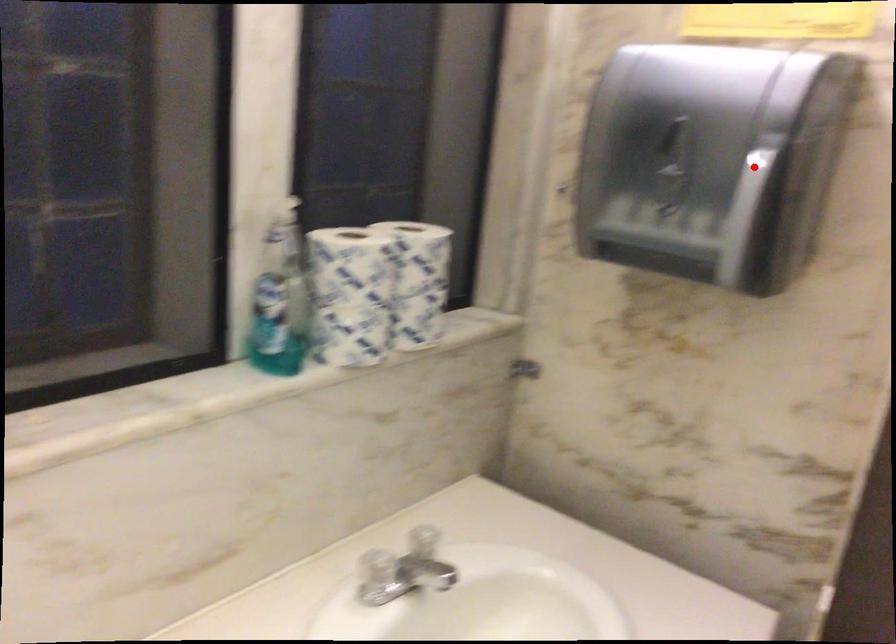
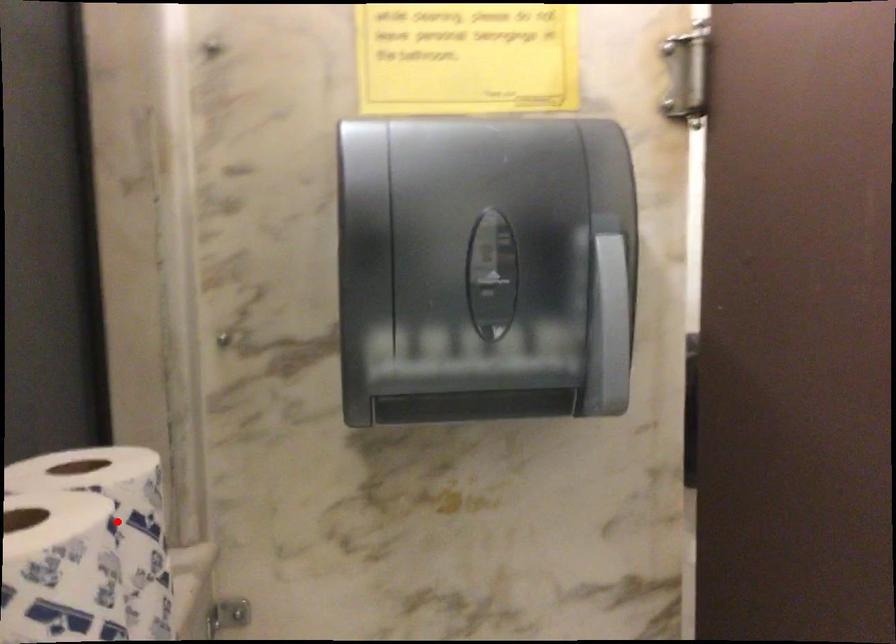
I am providing you with two images of the same scene from different viewpoints. A red point is marked on the first image and another point is marked on the second image. Are the points marked in image1 and image2 representing the same 3D position?

No